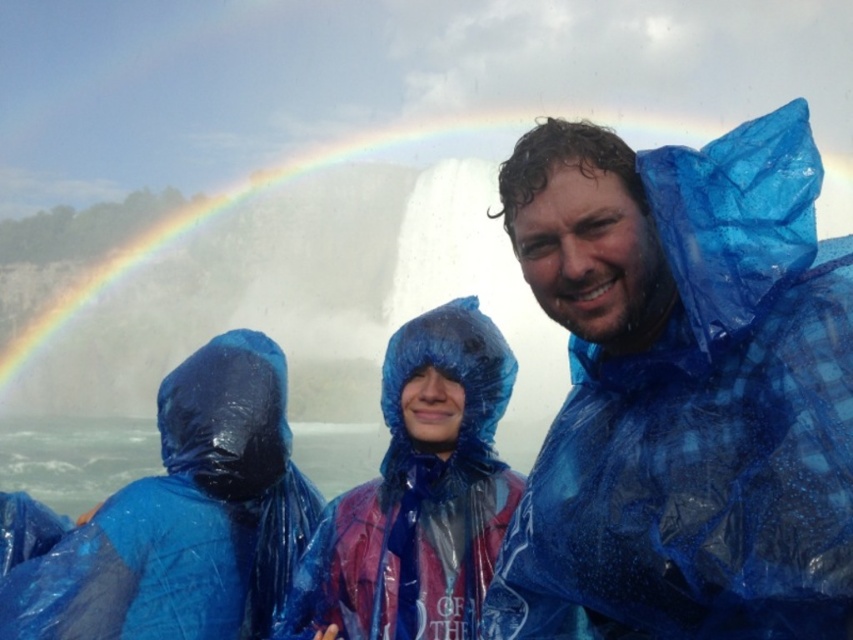
You are a photographer trying to capture the waterfall and the rainbow in the background. You have two points marked on your camera screen at coordinates point [53,605] and point [457,374]. Which point is closer to you, the photographer?

Point [53,605] is closer to the photographer than point [457,374] because it is positioned closer to the viewer according to the description.

You are a photographer trying to capture the rainbow in the background of the waterfall scene. You notice the blue translucent poncho at left might block your view. Can you move the poncho to a different location without moving the people? Explain why or why not.

The blue translucent poncho at left is positioned at point (184, 518), so it can be moved to another location without moving the people since the poncho is separate from them and its position is adjustable.